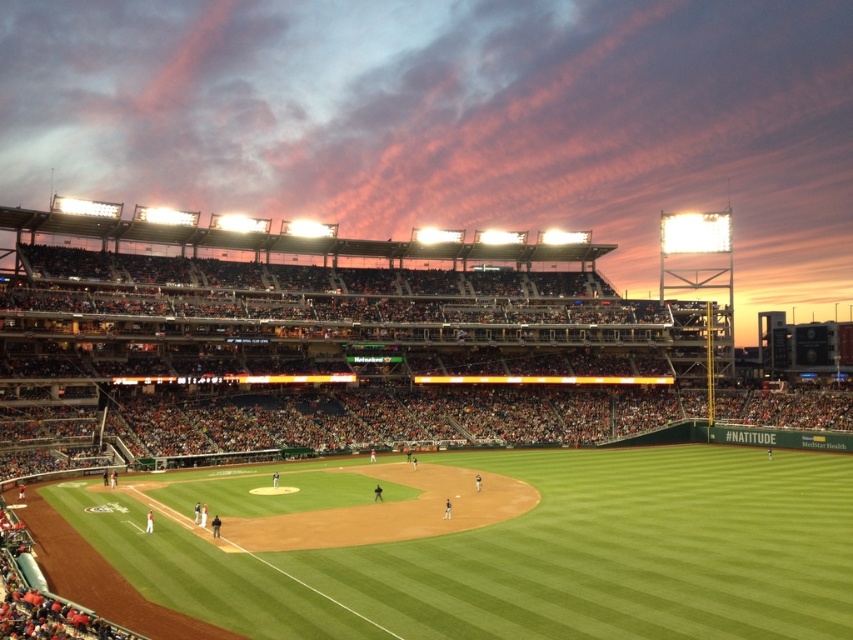
Between point (782, 612) and point (397, 618), which one is positioned in front?

Point (397, 618) is in front.

In the scene shown: Between green grass baseball stadium at center and green grass baseball field at center, which one has less height?

With less height is green grass baseball field at center.

Find the location of a particular element. Image resolution: width=853 pixels, height=640 pixels. green grass baseball stadium at center is located at coordinates (412, 436).

Locate an element on the screen. The height and width of the screenshot is (640, 853). green grass baseball stadium at center is located at coordinates (412, 436).